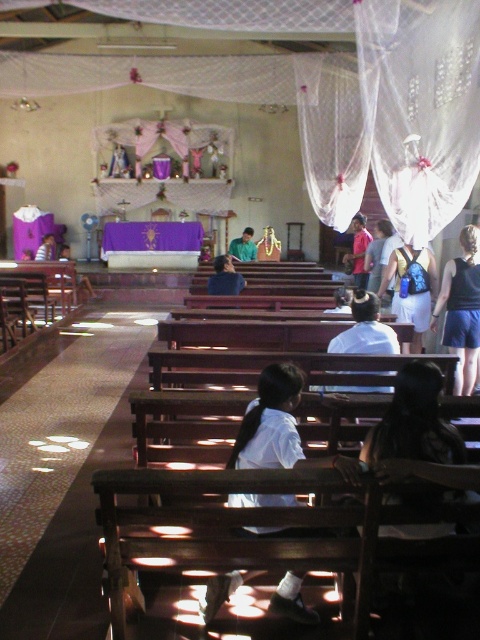
You are standing at the entrance of the church and notice the pink fabric at center. Can you determine its exact location based on the coordinates provided?

The pink fabric at center is located at point (359,250).

You are standing in the church and want to place a bouquet of flowers on the pink fabric at center. If your maximum reach is 8 meters, can you place the flowers without moving closer?

The pink fabric at center is 8.92 meters away from viewer. Since your maximum reach is 8 meters, you cannot place the flowers without moving closer.

You are standing at the back of the church and notice two items in the foreground. The blue denim shorts at lower right and the green matte shirt at center. Which item appears taller from your vantage point?

The blue denim shorts at lower right appears taller than the green matte shirt at center from your vantage point at the back of the church.